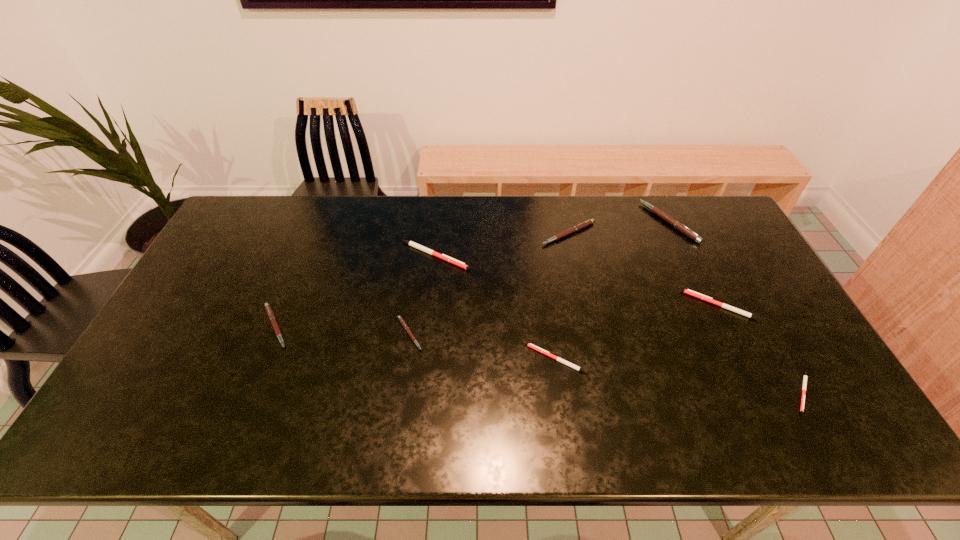
I want to click on the smallest white pen, so click(805, 375).

Locate an element on the screen. This screenshot has width=960, height=540. the shortest object is located at coordinates (805, 375).

Find the location of a particular element. free location located at the nib of the rightmost pink pen is located at coordinates (598, 222).

The image size is (960, 540). What are the coordinates of `vacant space situated at the nib of the rightmost pink pen` in the screenshot? It's located at [x=538, y=222].

Find the location of a particular element. This screenshot has height=540, width=960. free space located at the nib of the rightmost pink pen is located at coordinates (546, 222).

Locate an element on the screen. The image size is (960, 540). vacant space located at the nib of the third pink pen from left to right is located at coordinates (588, 329).

The height and width of the screenshot is (540, 960). Identify the location of free space located on the clicker of the leftmost white pen. click(585, 255).

Find the location of a particular element. The width and height of the screenshot is (960, 540). free location located 0.100m at the nib of the second smallest pink pen is located at coordinates (330, 327).

Image resolution: width=960 pixels, height=540 pixels. In order to click on vacant space located 0.390m on the clicker of the second farthest white pen in this screenshot , I will do `click(552, 306)`.

Locate an element on the screen. The height and width of the screenshot is (540, 960). vacant space located 0.300m on the clicker of the second farthest white pen is located at coordinates tap(583, 306).